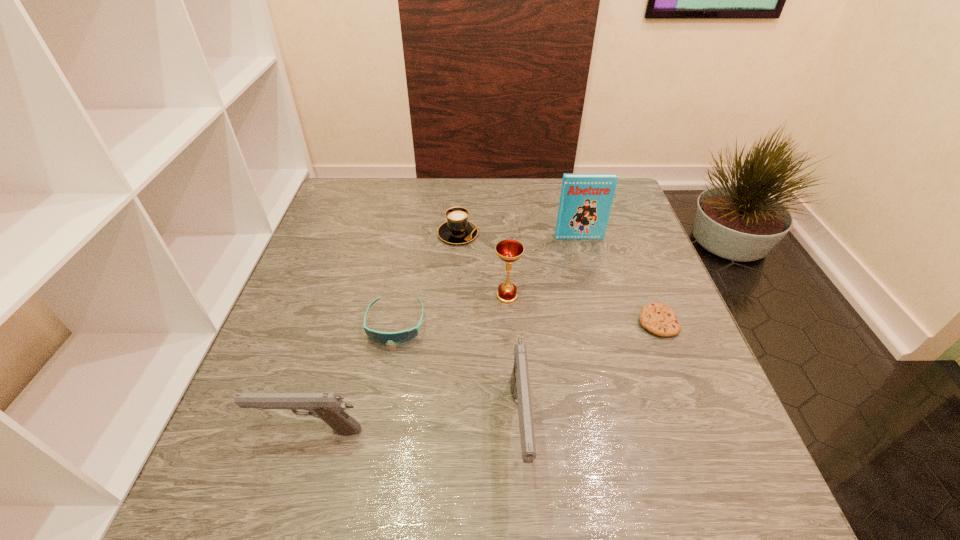
You are a GUI agent. You are given a task and a screenshot of the screen. Output one action in this format:
    pyautogui.click(x=<x>, y=<y>)
    Task: Click on the shorter pistol
    
    Given the screenshot: What is the action you would take?
    pyautogui.click(x=329, y=407)

The height and width of the screenshot is (540, 960). I want to click on the left pistol, so click(329, 407).

The width and height of the screenshot is (960, 540). Find the location of `the taller pistol`. the taller pistol is located at coordinates (519, 384).

Find the location of a particular element. This screenshot has width=960, height=540. cappuccino is located at coordinates (457, 229).

This screenshot has width=960, height=540. Find the location of `the third object from left to right`. the third object from left to right is located at coordinates (457, 229).

Where is `the shortest object`? the shortest object is located at coordinates (658, 318).

At what (x,y) coordinates should I click in order to perform the action: click on cookie. Please return your answer as a coordinate pair (x, y). The width and height of the screenshot is (960, 540). Looking at the image, I should click on (658, 318).

Locate an element on the screen. sunglasses is located at coordinates (401, 337).

You are a GUI agent. You are given a task and a screenshot of the screen. Output one action in this format:
    pyautogui.click(x=<x>, y=<y>)
    Task: Click on the chalice
    This screenshot has width=960, height=540.
    Given the screenshot: What is the action you would take?
    pyautogui.click(x=509, y=251)

Image resolution: width=960 pixels, height=540 pixels. In order to click on the sixth object from left to right in this screenshot , I will do `click(585, 204)`.